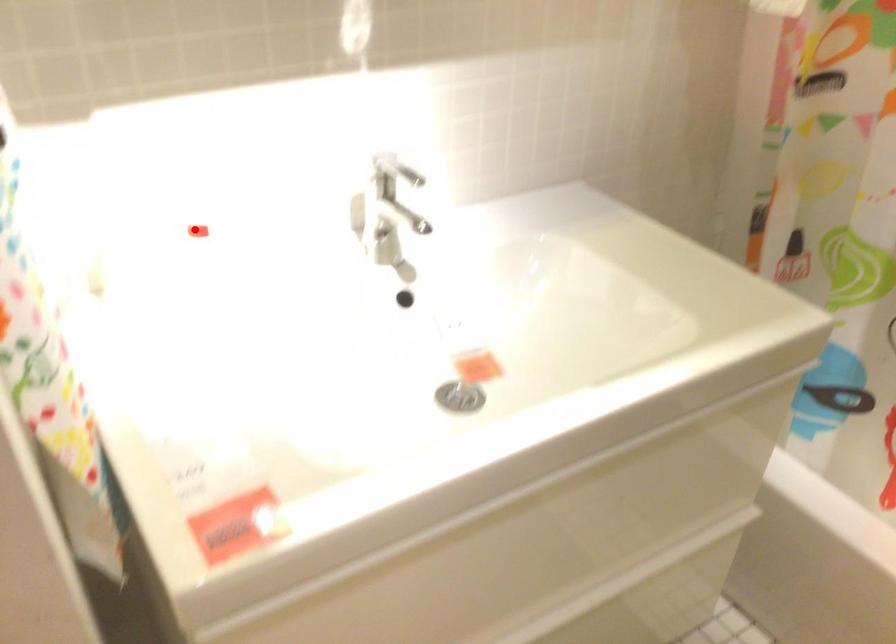
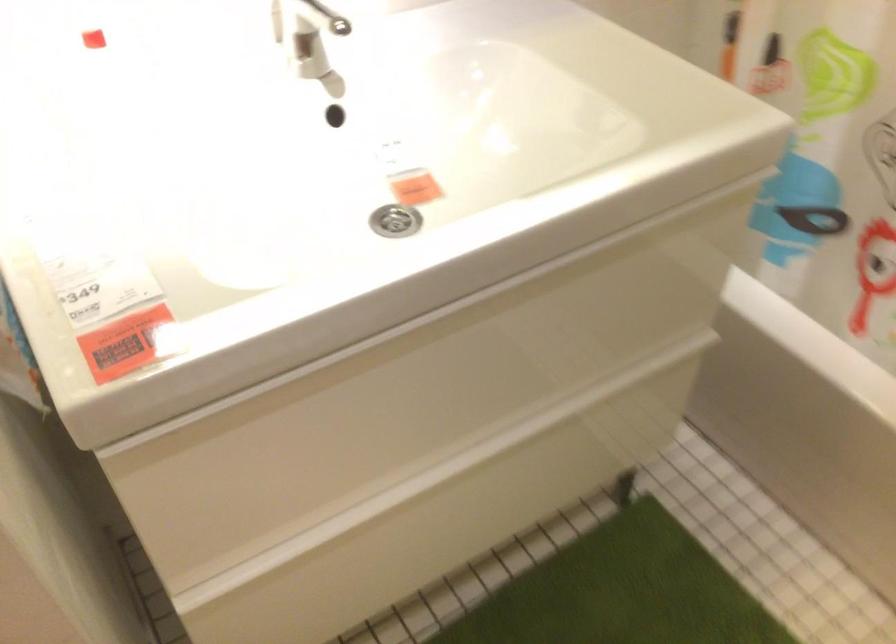
In the second image, find the point that corresponds to the highlighted location in the first image.

(92, 39)